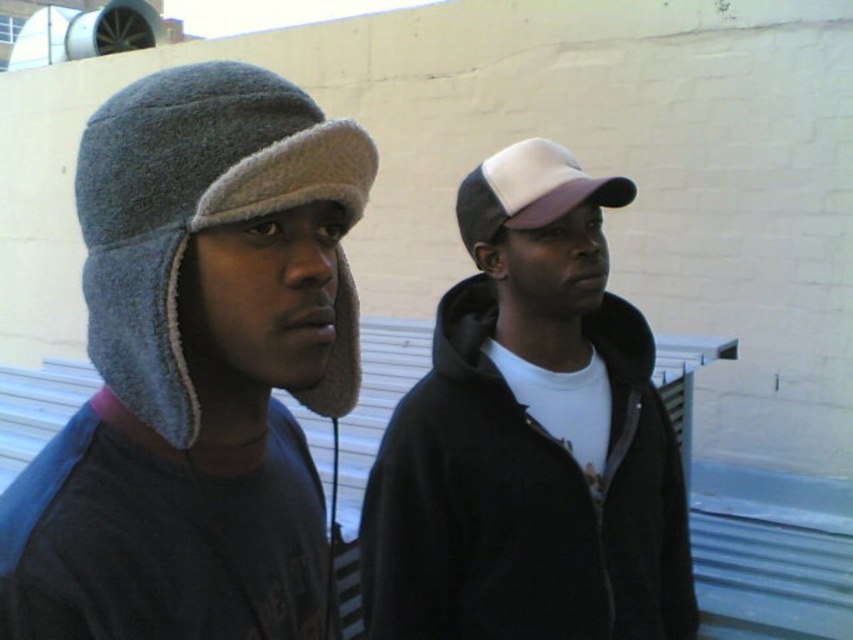
You are a photographer setting up a shot of two people. The scene has a gray fleece hat at left and a white mesh baseball cap at center. Which object is positioned lower in the image?

The gray fleece hat at left is located below the white mesh baseball cap at center, so it is positioned lower in the image.

You are standing in front of the white brick wall and see the two people. There is a point marked at coordinates (531, 436) which corresponds to a specific object in the scene. Which object is located at that point?

The point at (531, 436) marks the white fabric cap at center.